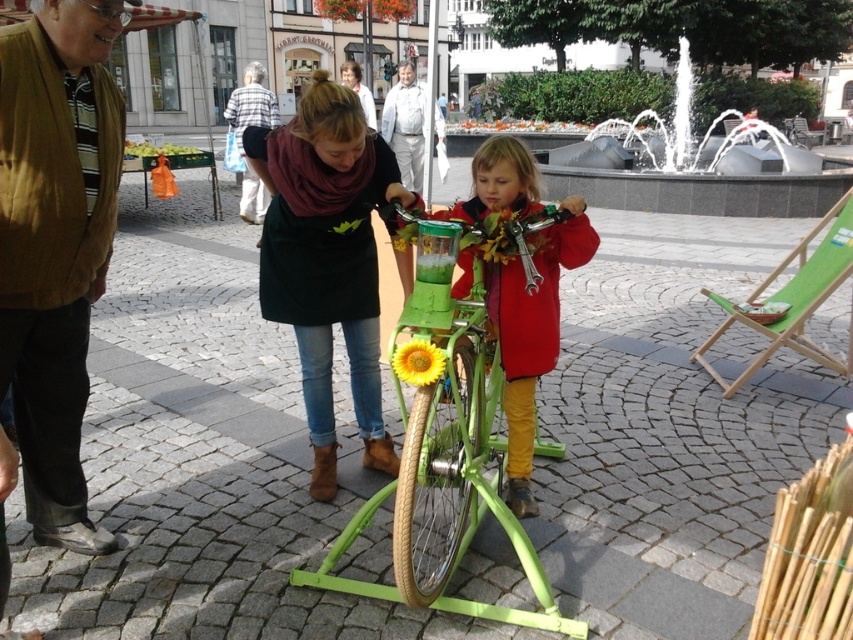
Question: Is matte black shirt at center bigger than yellow matte sunflower at center?

Choices:
 (A) no
 (B) yes

Answer: (B)

Question: Where is white stone fountain at upper center located in relation to yellow matte sunflower at center in the image?

Choices:
 (A) right
 (B) left

Answer: (A)

Question: Which object appears closest to the camera in this image?

Choices:
 (A) white stone fountain at upper center
 (B) white cotton shirt at center
 (C) green matte bicycle at center

Answer: (C)

Question: Which of the following is the closest to the observer?

Choices:
 (A) (355, 230)
 (B) (397, 100)
 (C) (451, 476)

Answer: (C)

Question: Does white stone fountain at upper center have a smaller size compared to white cotton shirt at center?

Choices:
 (A) yes
 (B) no

Answer: (B)

Question: Estimate the real-world distances between objects in this image. Which object is farther from the white stone fountain at upper center?

Choices:
 (A) yellow matte sunflower at center
 (B) brown woolen jacket at left
 (C) matte black shirt at center

Answer: (A)